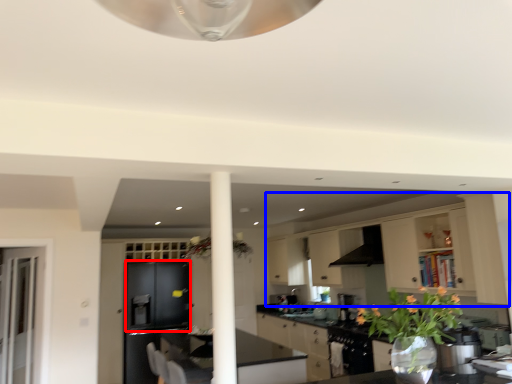
Question: Which object appears farthest to the camera in this image, cabinetry (highlighted by a red box) or cabinetry (highlighted by a blue box)?

Choices:
 (A) cabinetry
 (B) cabinetry

Answer: (A)